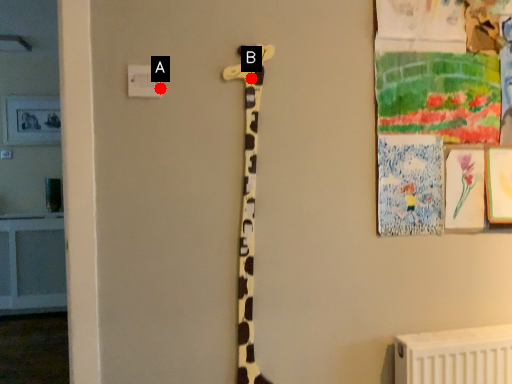
Question: Two points are circled on the image, labeled by A and B beside each circle. Which point is closer to the camera?

Choices:
 (A) A is closer
 (B) B is closer

Answer: (A)